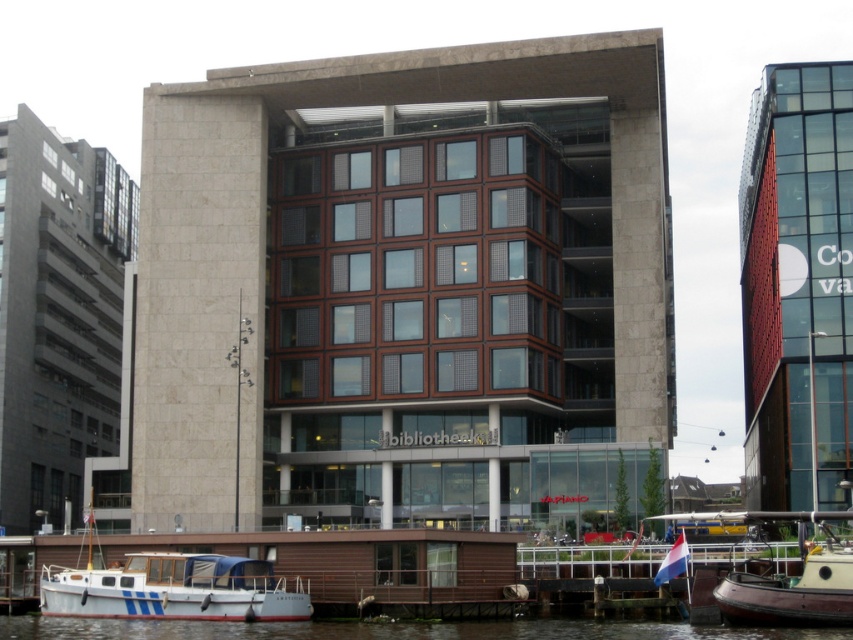
Can you confirm if smooth water at lower center is taller than brown wooden boat at lower right?

No.

Does smooth water at lower center appear under brown wooden boat at lower right?

Indeed, smooth water at lower center is positioned under brown wooden boat at lower right.

Where is `smooth water at lower center`? The height and width of the screenshot is (640, 853). smooth water at lower center is located at coordinates (392, 628).

Identify the location of smooth water at lower center. Image resolution: width=853 pixels, height=640 pixels. (392, 628).

Does white matte boat at lower left have a smaller size compared to brown wooden boat at lower right?

Indeed, white matte boat at lower left has a smaller size compared to brown wooden boat at lower right.

Can you confirm if white matte boat at lower left is shorter than brown wooden boat at lower right?

Correct, white matte boat at lower left is not as tall as brown wooden boat at lower right.

Locate an element on the screen. white matte boat at lower left is located at coordinates (173, 589).

Does white matte boat at lower left appear on the left side of smooth water at lower center?

Correct, you'll find white matte boat at lower left to the left of smooth water at lower center.

Which is behind, point (105, 570) or point (236, 630)?

The point (105, 570) is more distant.

Where is `white matte boat at lower left`? The image size is (853, 640). white matte boat at lower left is located at coordinates (173, 589).